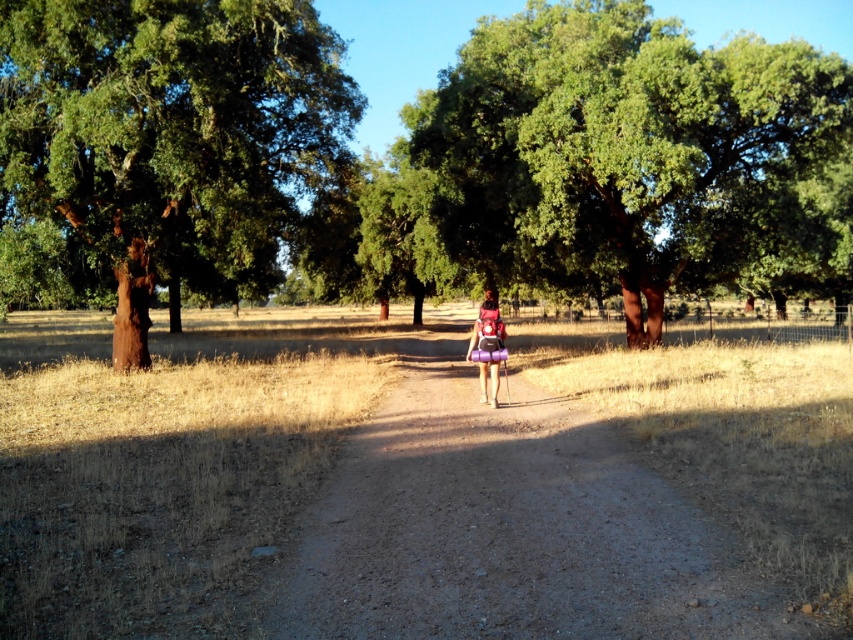
Question: Does dirt path at center appear on the left side of brown bark tree at left?

Choices:
 (A) yes
 (B) no

Answer: (B)

Question: Which point is farther from the camera taking this photo?

Choices:
 (A) click(x=315, y=582)
 (B) click(x=498, y=381)

Answer: (B)

Question: Where is green leafy tree at center located in relation to purple fabric backpack at center in the image?

Choices:
 (A) right
 (B) left

Answer: (A)

Question: Can you confirm if dirt path at center is positioned to the right of purple fabric backpack at center?

Choices:
 (A) yes
 (B) no

Answer: (B)

Question: Which object appears closest to the camera in this image?

Choices:
 (A) brown bark tree at left
 (B) dirt path at center
 (C) green leafy tree at center

Answer: (B)

Question: Which object is closer to the camera taking this photo?

Choices:
 (A) green leafy tree at center
 (B) purple fabric backpack at center
 (C) dirt path at center

Answer: (C)